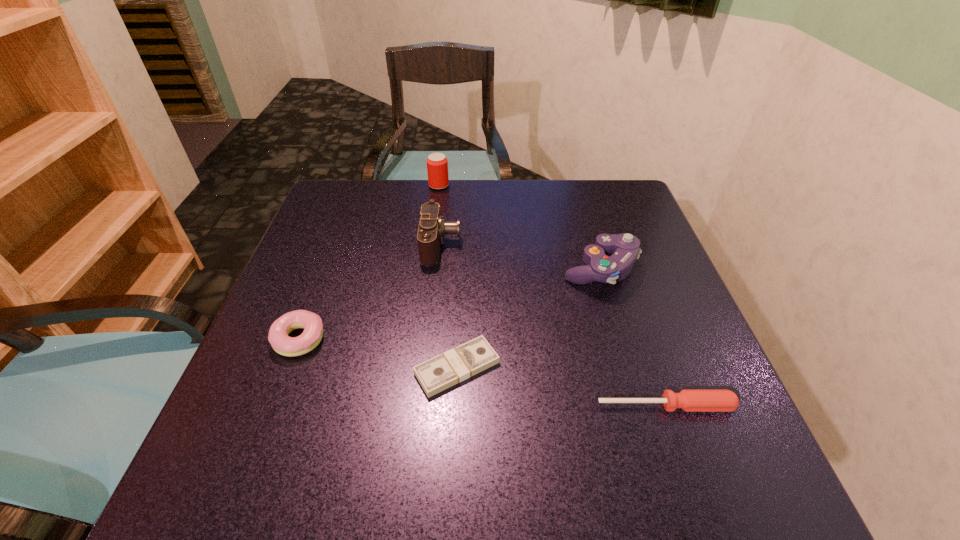
Identify the location of unoccupied position between the camera and the third shortest object. This screenshot has height=540, width=960. (371, 292).

Image resolution: width=960 pixels, height=540 pixels. Identify the location of vacant point located between the dollar and the control. (528, 318).

Image resolution: width=960 pixels, height=540 pixels. Identify the location of free spot between the second shortest object and the camera. (553, 325).

At what (x,y) coordinates should I click in order to perform the action: click on free point between the leftmost object and the camera. Please return your answer as a coordinate pair (x, y). The height and width of the screenshot is (540, 960). Looking at the image, I should click on (371, 292).

I want to click on the fifth closest object to the control, so click(x=278, y=337).

Point out which object is positioned as the second nearest to the camera. Please provide its 2D coordinates. Your answer should be formatted as a tuple, i.e. [(x, y)], where the tuple contains the x and y coordinates of a point satisfying the conditions above.

[(464, 361)]

Where is `free space that satisfies the following two spatial constraints: 1. on the front-facing side of the camera; 2. on the right side of the control`? This screenshot has width=960, height=540. free space that satisfies the following two spatial constraints: 1. on the front-facing side of the camera; 2. on the right side of the control is located at coordinates (439, 268).

Locate an element on the screen. The image size is (960, 540). vacant area that satisfies the following two spatial constraints: 1. on the front-facing side of the camera; 2. on the right side of the dollar is located at coordinates (428, 367).

You are a GUI agent. You are given a task and a screenshot of the screen. Output one action in this format:
    pyautogui.click(x=<x>, y=<y>)
    Task: Click on the vacant region that satisfies the following two spatial constraints: 1. on the front-facing side of the camera; 2. on the right side of the second shortest object
    Image resolution: width=960 pixels, height=540 pixels.
    Given the screenshot: What is the action you would take?
    pyautogui.click(x=424, y=406)

The width and height of the screenshot is (960, 540). In order to click on vacant region that satisfies the following two spatial constraints: 1. on the front-facing side of the camera; 2. on the left side of the fifth tallest object in this screenshot , I will do `click(424, 406)`.